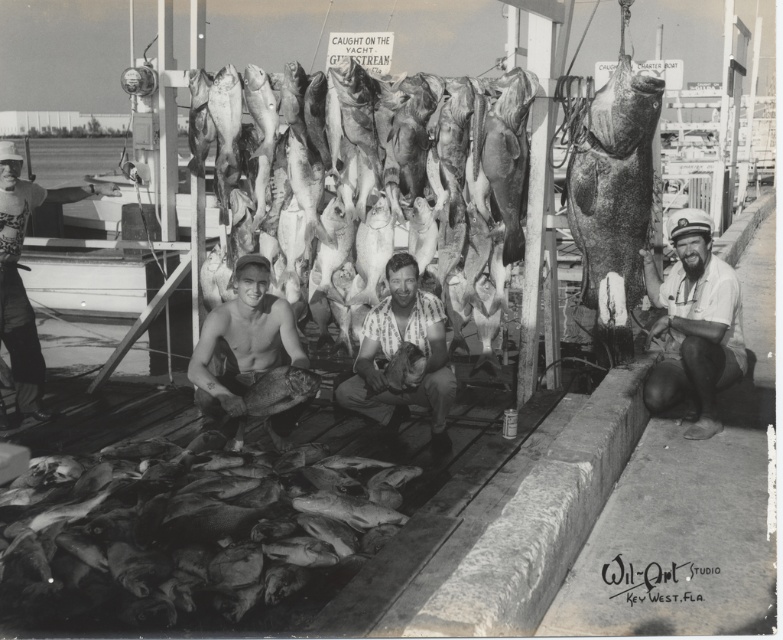
Question: Does shiny silver fish at center come in front of smooth skin man at center?

Choices:
 (A) yes
 (B) no

Answer: (B)

Question: Among these points, which one is farthest from the camera?

Choices:
 (A) (381, 416)
 (B) (298, 368)
 (C) (92, 618)

Answer: (A)

Question: Which point appears farthest from the camera in this image?

Choices:
 (A) (2, 189)
 (B) (78, 620)
 (C) (597, 164)
 (D) (244, 147)

Answer: (D)

Question: Which point is farther from the camera taking this photo?

Choices:
 (A) (482, 212)
 (B) (449, 448)
 (C) (583, 282)

Answer: (A)

Question: Considering the relative positions of smooth skin fish at lower left and shiny silver helmet at left in the image provided, where is smooth skin fish at lower left located with respect to shiny silver helmet at left?

Choices:
 (A) below
 (B) above

Answer: (A)

Question: Can you confirm if smooth skin fish at lower left is thinner than shiny silver helmet at left?

Choices:
 (A) yes
 (B) no

Answer: (B)